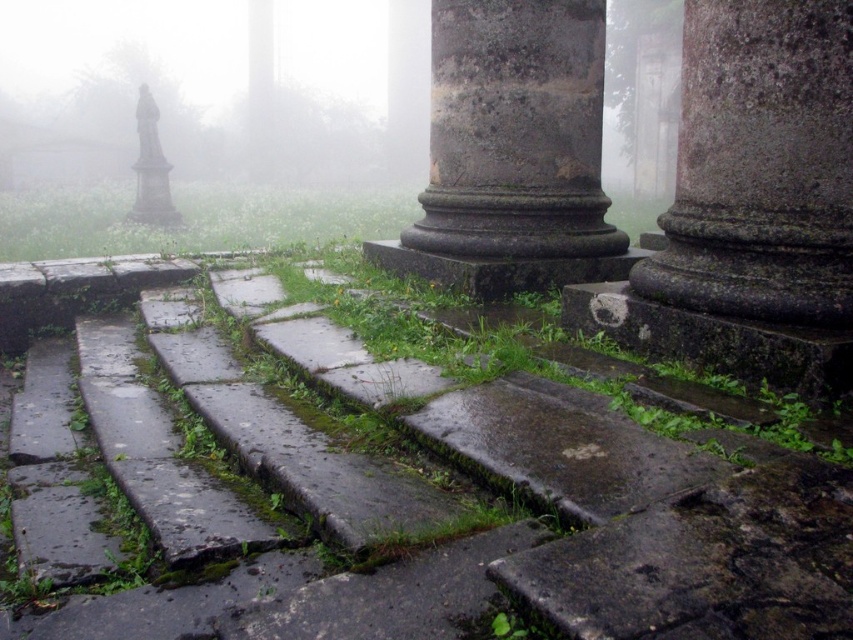
You are standing at the bottom of the weathered stone steps leading up to the ancient structure. You want to walk towards the stone statue at left. Should you go around the rough stone pillar at center to reach it?

The rough stone pillar at center is closer to the viewer than the stone statue at left, so you need to go around the rough stone pillar at center to reach the stone statue at left.

You are standing at the base of the mossy stone steps at lower center and want to reach the top of the rough stone pillar at center. Which direction should you move to get closer to the pillar?

You should move upward along the mossy stone steps at lower center to get closer to the rough stone pillar at center since the steps are positioned under the pillar.